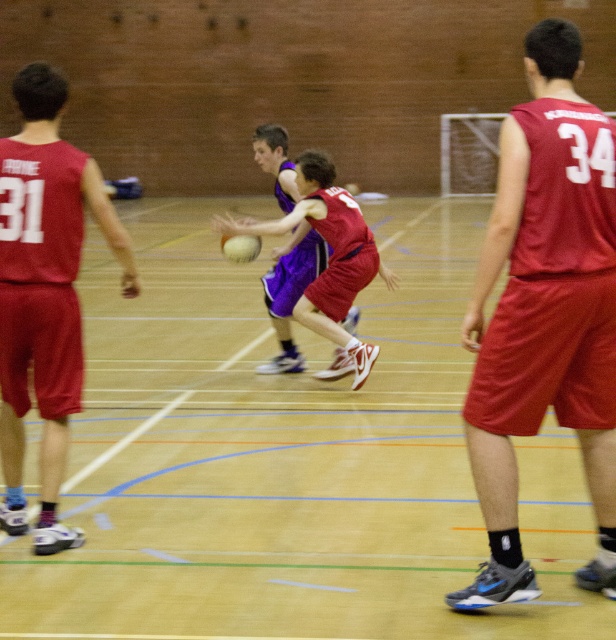
Question: Which of these objects is positioned closest to the matte red jersey at left?

Choices:
 (A) shiny purple jersey at center
 (B) matte red jersey at right

Answer: (B)

Question: Which object is positioned closest to the glossy rubber basketball at center?

Choices:
 (A) matte red jersey at left
 (B) matte red jersey at right

Answer: (A)

Question: Can you confirm if matte red jersey at left is smaller than shiny purple jersey at center?

Choices:
 (A) no
 (B) yes

Answer: (B)

Question: Which point appears farthest from the camera in this image?

Choices:
 (A) (238, 256)
 (B) (577, 196)
 (C) (330, 196)
 (D) (30, 320)

Answer: (A)

Question: Is matte red jersey at right above shiny purple jersey at center?

Choices:
 (A) no
 (B) yes

Answer: (A)

Question: Does matte red jersey at right appear on the left side of shiny purple jersey at center?

Choices:
 (A) no
 (B) yes

Answer: (A)